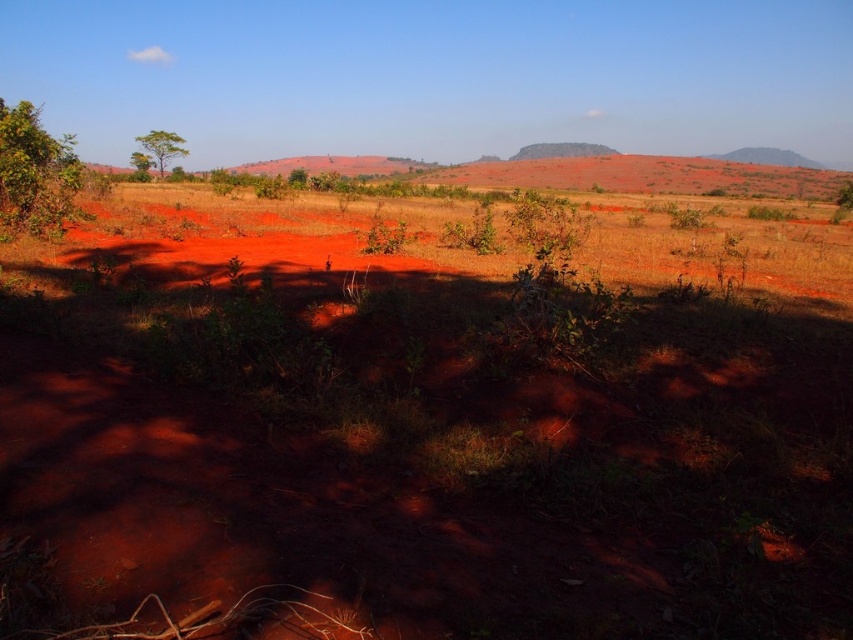
Is green leafy tree at left positioned in front of green leafy tree at upper left?

Yes, it is in front of green leafy tree at upper left.

In the scene shown: Who is positioned more to the right, green leafy tree at left or green leafy tree at upper left?

Positioned to the right is green leafy tree at upper left.

Is point (62, 144) more distant than point (157, 157)?

No.

At what (x,y) coordinates should I click in order to perform the action: click on green leafy tree at left. Please return your answer as a coordinate pair (x, y). Image resolution: width=853 pixels, height=640 pixels. Looking at the image, I should click on (33, 172).